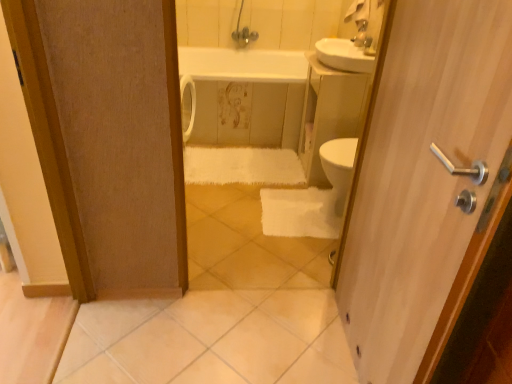
Question: Considering their positions, is white glossy sink at upper right located in front of or behind wooden door handle at right?

Choices:
 (A) behind
 (B) front

Answer: (A)

Question: From the image's perspective, is white glossy sink at upper right positioned above or below wooden door handle at right?

Choices:
 (A) below
 (B) above

Answer: (B)

Question: Estimate the real-world distances between objects in this image. Which object is closer to the white glossy sink at upper right?

Choices:
 (A) white glossy tile at lower center
 (B) white glossy sink at upper center
 (C) wooden door handle at right
 (D) metallic silver faucet at upper center
 (E) white glossy bathtub at center

Answer: (D)

Question: Based on their relative distances, which object is nearer to the metallic silver faucet at upper center?

Choices:
 (A) white glossy sink at upper right
 (B) white glossy sink at upper center
 (C) white fluffy bath towel at center
 (D) wooden door handle at right
 (E) white glossy bathtub at center

Answer: (A)